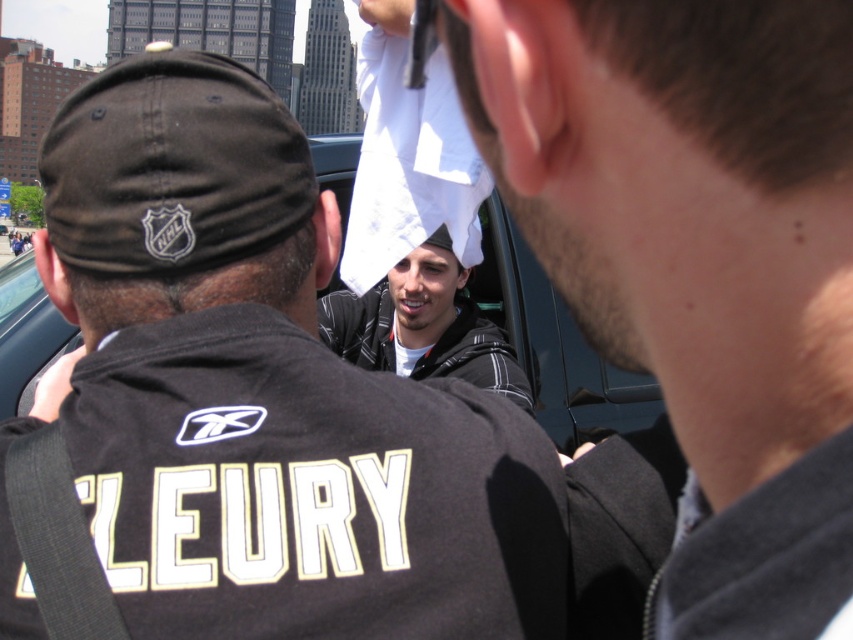
You are a photographer at the event and need to capture both the black fabric baseball cap at upper center and the white cotton towel at center in a single frame. Which object should you zoom out to include more of its surroundings to ensure both are visible?

Since the black fabric baseball cap at upper center is wider than the white cotton towel at center, you should zoom out to include more of the surroundings of the black fabric baseball cap at upper center to ensure both objects are visible in the frame.

You are a photographer at the event and need to capture a clear shot of both the black fabric baseball cap at upper center and the white cotton towel at center. Based on their positions, which object should you focus on first to ensure both are in frame?

The black fabric baseball cap at upper center is located above the white cotton towel at center, so you should focus on the white cotton towel at center first to ensure both are in frame.

What is the location of the point with coordinates (257,396) in the image?

The point with coordinates (257,396) is located on the white paper towel at center.